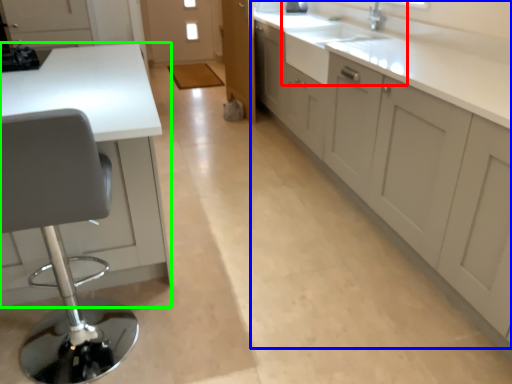
Question: Which is nearer to the sink (highlighted by a red box)? cabinetry (highlighted by a blue box) or countertop (highlighted by a green box).

Choices:
 (A) cabinetry
 (B) countertop

Answer: (A)